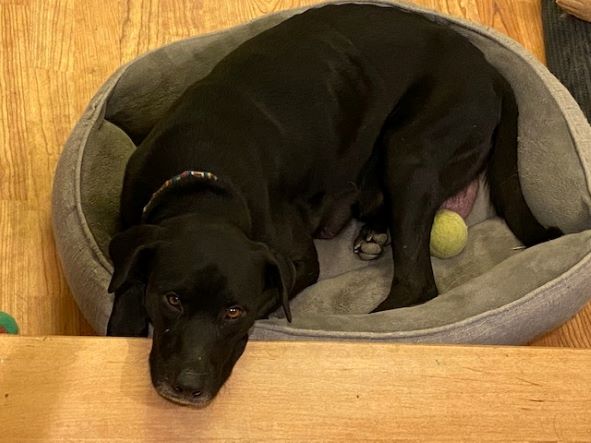
Where is `floor wooden`? The width and height of the screenshot is (591, 443). floor wooden is located at coordinates (64, 52), (372, 396).